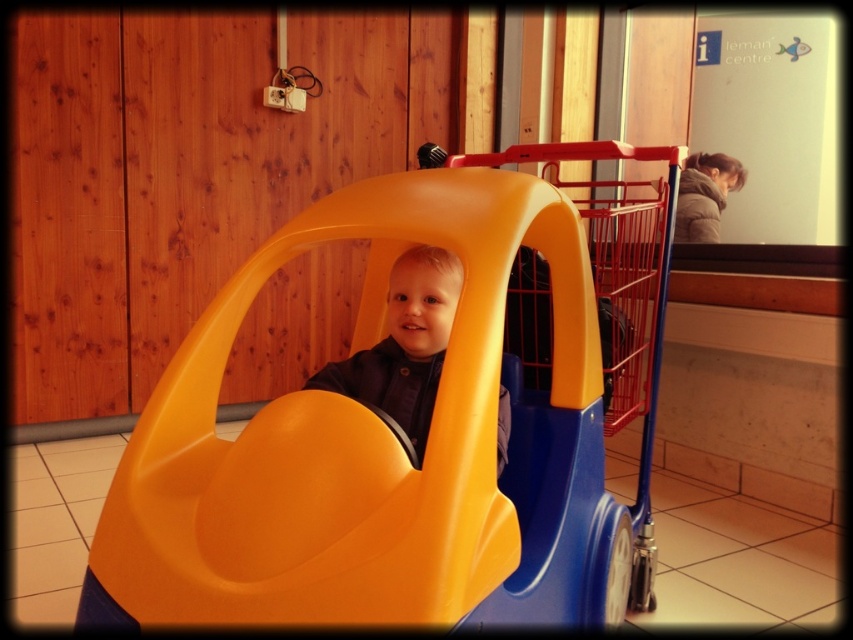
Can you confirm if matte plastic car at center is positioned above yellow plastic toy car at center?

No.

Measure the distance between matte plastic car at center and camera.

The distance of matte plastic car at center from camera is 33.90 inches.

This screenshot has width=853, height=640. I want to click on matte plastic car at center, so click(396, 440).

Looking at this image, how distant is yellow plastic toy car at center from matte plastic boy at center?

The distance of yellow plastic toy car at center from matte plastic boy at center is 20.59 inches.

Is point (665, 211) positioned before point (415, 376)?

No.

Is point (608, 388) positioned in front of point (410, 262)?

No, it is behind (410, 262).

Where is `yellow plastic toy car at center`? yellow plastic toy car at center is located at coordinates (614, 294).

Who is more distant from viewer, (119, 580) or (393, 381)?

The point (393, 381) is more distant.

Identify the location of matte plastic car at center. (396, 440).

Measure the distance between point (120,561) and camera.

Point (120,561) and camera are 1.01 meters apart.

Identify the location of matte plastic car at center. (396, 440).